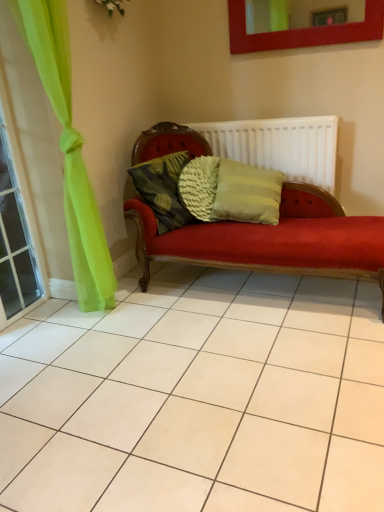
Question: Would you say woven fabric pillow at center is to the left or to the right of green sheer curtain at left in the picture?

Choices:
 (A) right
 (B) left

Answer: (A)

Question: Is woven fabric pillow at center bigger or smaller than green sheer curtain at left?

Choices:
 (A) big
 (B) small

Answer: (B)

Question: Estimate the real-world distances between objects in this image. Which object is farther from the woven fabric pillow at center?

Choices:
 (A) green sheer curtain at left
 (B) white ribbed radiator at center
 (C) matte red picture frame at upper center

Answer: (C)

Question: Which of these objects is positioned farthest from the woven fabric pillow at center?

Choices:
 (A) white ribbed radiator at center
 (B) matte red picture frame at upper center
 (C) green sheer curtain at left

Answer: (B)